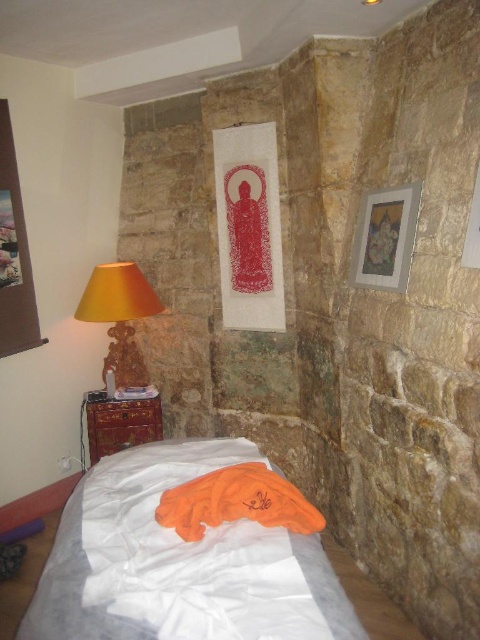
You are standing in the room and want to place a new decorative item between the white fabric bed at lower left and the orange fabric lampshade at left. Based on their positions, which object should the decorative item be closer to?

Result: The decorative item should be closer to the orange fabric lampshade at left because the white fabric bed at lower left is in front of it, meaning the lampshade is further back.

You are standing in the room and want to place a small lamp on the white fabric bed at lower left. Based on its position, where exactly should you place the lamp?

The white fabric bed at lower left is located at point (180, 563), so you should place the lamp there.